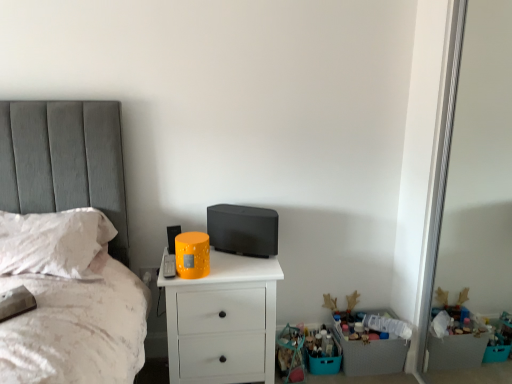
Question: Does white soft pillow at left have a lesser width compared to white matte chest of drawers at center?

Choices:
 (A) no
 (B) yes

Answer: (A)

Question: Is white soft pillow at left outside of white matte chest of drawers at center?

Choices:
 (A) no
 (B) yes

Answer: (B)

Question: Can you confirm if white soft pillow at left is wider than white matte chest of drawers at center?

Choices:
 (A) no
 (B) yes

Answer: (B)

Question: From a real-world perspective, does white soft pillow at left stand above white matte chest of drawers at center?

Choices:
 (A) yes
 (B) no

Answer: (A)

Question: From the image's perspective, does white soft pillow at left appear lower than white matte chest of drawers at center?

Choices:
 (A) yes
 (B) no

Answer: (B)

Question: From the image's perspective, is white soft pillow at left on top of white matte chest of drawers at center?

Choices:
 (A) no
 (B) yes

Answer: (B)

Question: Does white matte chest of drawers at center come behind white soft pillow at left?

Choices:
 (A) yes
 (B) no

Answer: (A)

Question: Is white matte chest of drawers at center shorter than white soft pillow at left?

Choices:
 (A) yes
 (B) no

Answer: (B)

Question: Is white matte chest of drawers at center wider than white soft pillow at left?

Choices:
 (A) no
 (B) yes

Answer: (A)

Question: From the image's perspective, would you say white matte chest of drawers at center is shown under white soft pillow at left?

Choices:
 (A) no
 (B) yes

Answer: (B)

Question: Is white matte chest of drawers at center placed right next to white soft pillow at left?

Choices:
 (A) yes
 (B) no

Answer: (B)

Question: Is white matte chest of drawers at center at the left side of white soft pillow at left?

Choices:
 (A) yes
 (B) no

Answer: (B)

Question: Is plastic crate at lower right at the left side of white soft pillow at left?

Choices:
 (A) yes
 (B) no

Answer: (B)